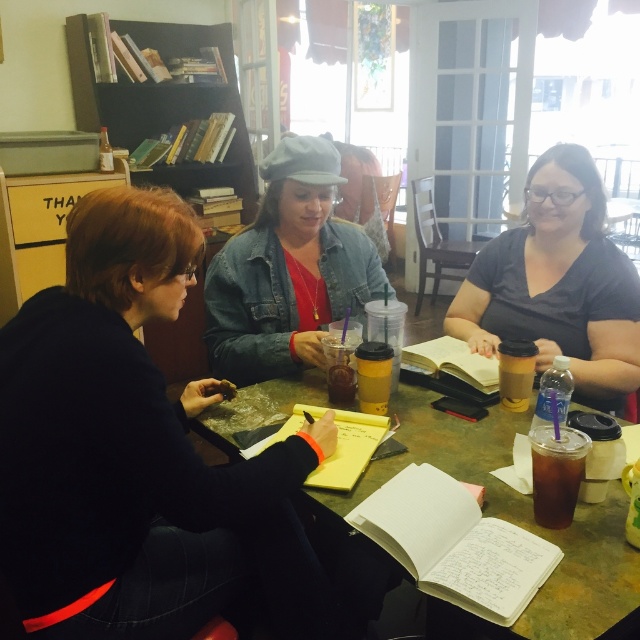
From the picture: Can you confirm if black wood bookshelf at upper left is thinner than dark brown glass at lower right?

No.

Is black wood bookshelf at upper left to the right of dark brown glass at lower right from the viewer's perspective?

In fact, black wood bookshelf at upper left is to the left of dark brown glass at lower right.

Who is more distant from viewer, (173, 35) or (532, 504)?

The point (173, 35) is behind.

Where is `black wood bookshelf at upper left`? This screenshot has width=640, height=640. black wood bookshelf at upper left is located at coordinates (164, 104).

Who is higher up, dark gray matte shirt at center or translucent plastic cup at center?

dark gray matte shirt at center is above.

Who is more distant from viewer, (612, 243) or (504, 372)?

Positioned behind is point (612, 243).

Identify the location of dark gray matte shirt at center. The height and width of the screenshot is (640, 640). (557, 284).

Is point (584, 456) behind point (520, 371)?

No, it is not.

Is point (561, 522) positioned before point (522, 380)?

Yes, it is in front of point (522, 380).

Locate an element on the screen. The height and width of the screenshot is (640, 640). dark brown glass at lower right is located at coordinates (556, 472).